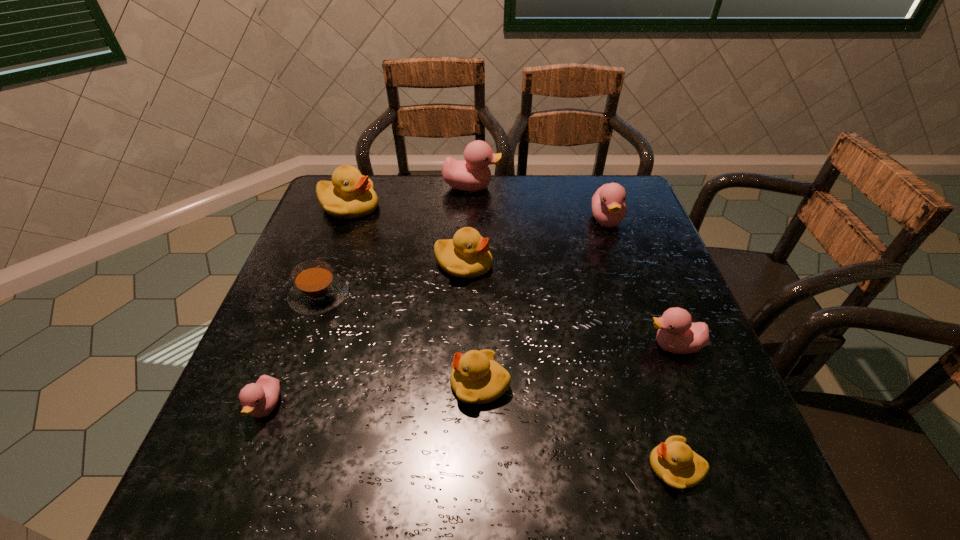
Identify which duckling is the third nearest to the third farthest yellow duckling. Please provide its 2D coordinates. Your answer should be formatted as a tuple, i.e. [(x, y)], where the tuple contains the x and y coordinates of a point satisfying the conditions above.

[(677, 334)]

Find the location of a particular element. the fourth closest pink duckling to the nearest yellow duckling is located at coordinates (472, 174).

Where is `the closest pink duckling to the shortest duckling`? This screenshot has width=960, height=540. the closest pink duckling to the shortest duckling is located at coordinates click(677, 334).

Identify which yellow duckling is located as the second nearest to the biggest yellow duckling. Please provide its 2D coordinates. Your answer should be formatted as a tuple, i.e. [(x, y)], where the tuple contains the x and y coordinates of a point satisfying the conditions above.

[(476, 378)]

Identify the location of yellow duckling that is the third closest to the second smallest pink duckling. The width and height of the screenshot is (960, 540). (467, 255).

Find the location of a particular element. free space in the image that satisfies the following two spatial constraints: 1. at the face of the third farthest yellow duckling; 2. on the front-facing side of the leftmost pink duckling is located at coordinates 480,407.

The height and width of the screenshot is (540, 960). What are the coordinates of `vacant point that satisfies the following two spatial constraints: 1. at the face of the second nearest yellow duckling; 2. on the front-facing side of the nearest pink duckling` in the screenshot? It's located at (480, 407).